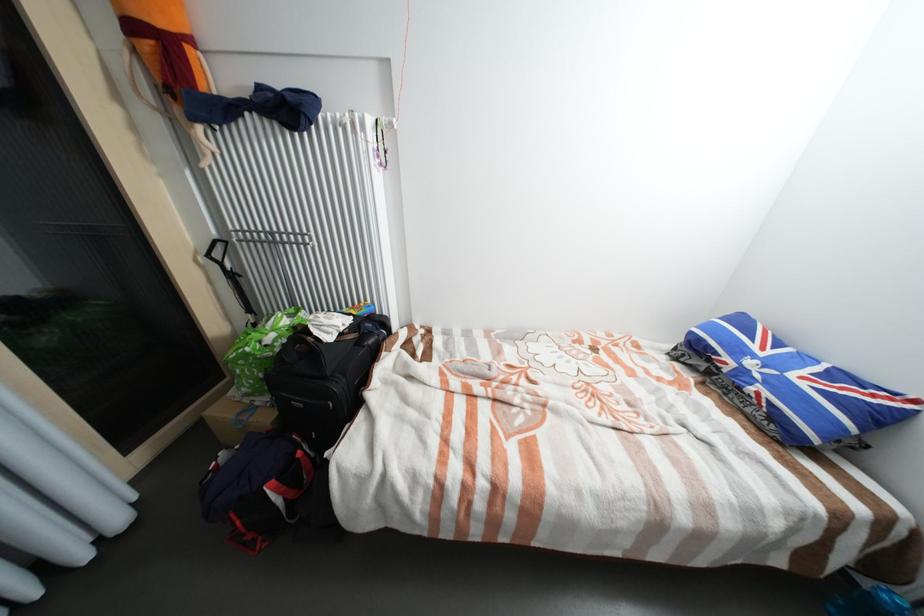
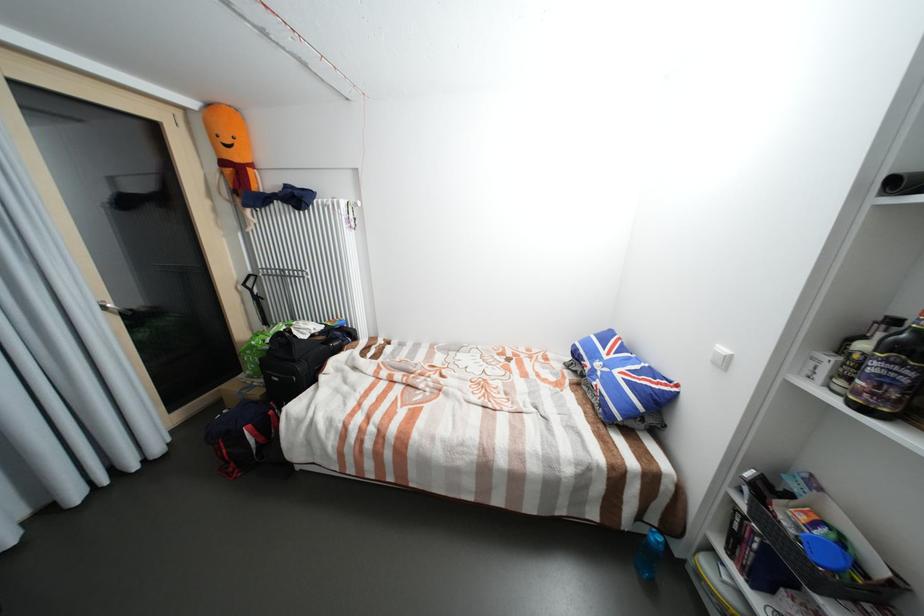
Locate, in the second image, the point that corresponds to [769,354] in the first image.

(613, 358)